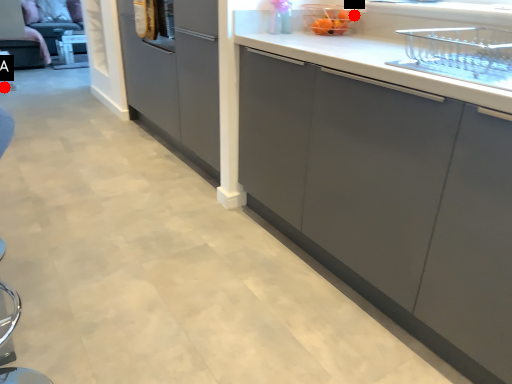
Question: Two points are circled on the image, labeled by A and B beside each circle. Which point appears closest to the camera in this image?

Choices:
 (A) A is closer
 (B) B is closer

Answer: (B)